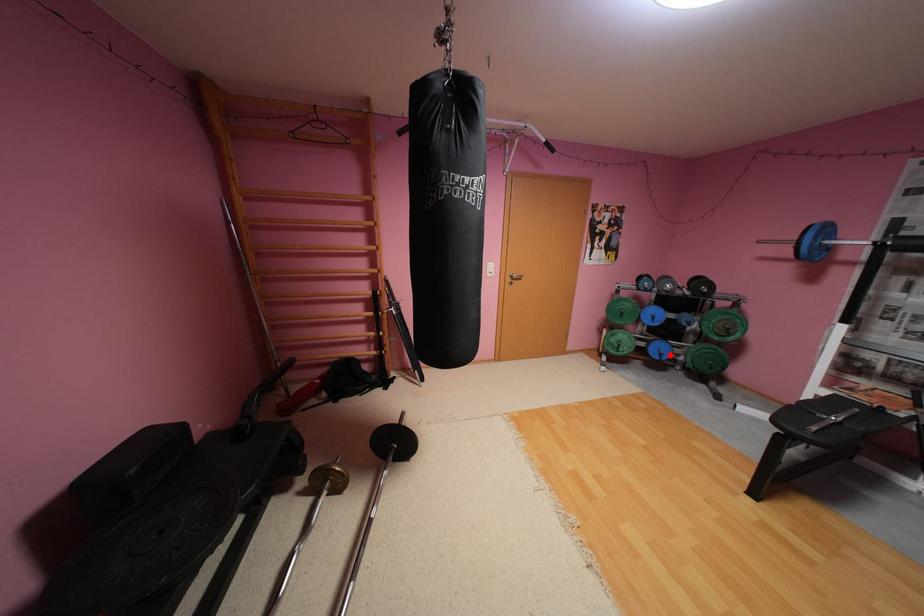
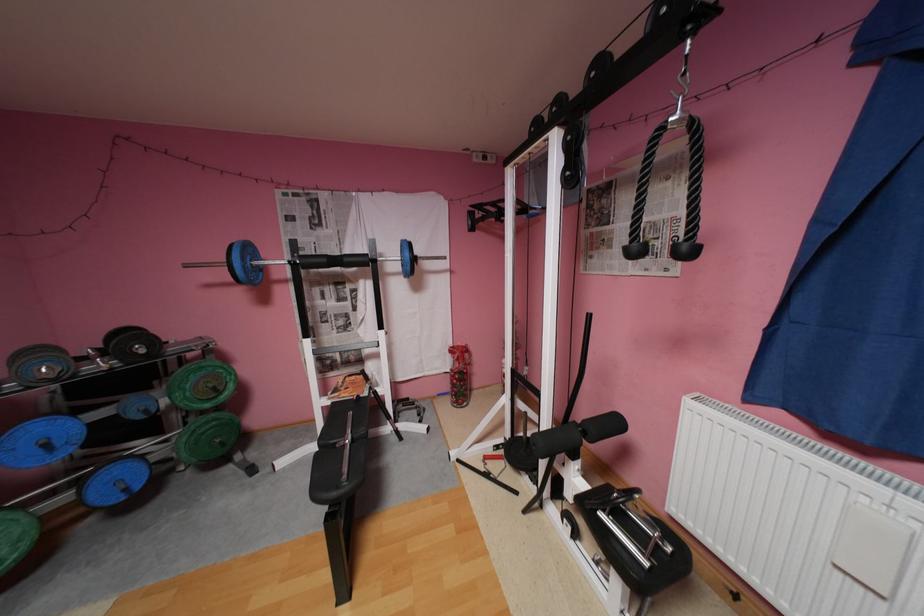
Question: I am providing you with two images of the same scene from different viewpoints. Image1 has a red point marked. In image2, the corresponding 3D location appears at what relative position? Reply with the corresponding letter.

Choices:
 (A) Closer
 (B) Farther

Answer: (A)